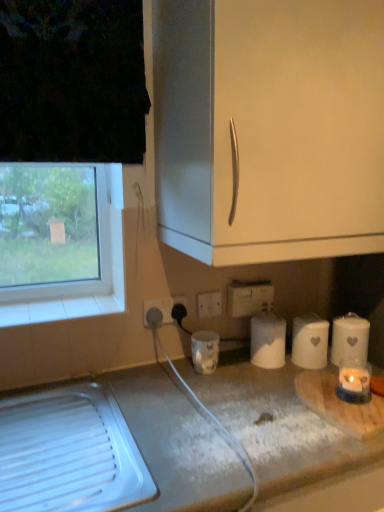
Question: Is white matte paper towel at lower right, marked as the second paper towel in a right-to-left arrangement, smaller than white plastic power plugs and sockets at lower center?

Choices:
 (A) no
 (B) yes

Answer: (A)

Question: From the image's perspective, would you say white matte paper towel at lower right, marked as the second paper towel in a right-to-left arrangement, is positioned over white plastic power plugs and sockets at lower center?

Choices:
 (A) yes
 (B) no

Answer: (B)

Question: Is white matte paper towel at lower right, marked as the second paper towel in a right-to-left arrangement, positioned before white plastic power plugs and sockets at lower center?

Choices:
 (A) yes
 (B) no

Answer: (A)

Question: Is the depth of white matte paper towel at lower right, marked as the second paper towel in a right-to-left arrangement, greater than that of white plastic power plugs and sockets at lower center?

Choices:
 (A) no
 (B) yes

Answer: (A)

Question: From a real-world perspective, is white matte paper towel at lower right, the second paper towel in the left-to-right sequence, over white plastic power plugs and sockets at lower center?

Choices:
 (A) no
 (B) yes

Answer: (A)

Question: Does white matte paper towel at lower right, the second paper towel in the left-to-right sequence, have a lesser width compared to white plastic power plugs and sockets at lower center?

Choices:
 (A) no
 (B) yes

Answer: (A)

Question: Does wooden cutting board at lower right have a greater width compared to white ceramic candle at lower center?

Choices:
 (A) yes
 (B) no

Answer: (A)

Question: From the image's perspective, is wooden cutting board at lower right above white ceramic candle at lower center?

Choices:
 (A) no
 (B) yes

Answer: (A)

Question: Is wooden cutting board at lower right not within white ceramic candle at lower center?

Choices:
 (A) no
 (B) yes

Answer: (B)

Question: Does wooden cutting board at lower right have a greater height compared to white ceramic candle at lower center?

Choices:
 (A) no
 (B) yes

Answer: (A)

Question: Does wooden cutting board at lower right appear on the left side of white ceramic candle at lower center?

Choices:
 (A) no
 (B) yes

Answer: (A)

Question: Can you confirm if wooden cutting board at lower right is thinner than white ceramic candle at lower center?

Choices:
 (A) yes
 (B) no

Answer: (B)

Question: From the image's perspective, would you say white matte cabinet handle at upper center is positioned over white matte paper towel at center, the third paper towel when ordered from right to left?

Choices:
 (A) yes
 (B) no

Answer: (A)